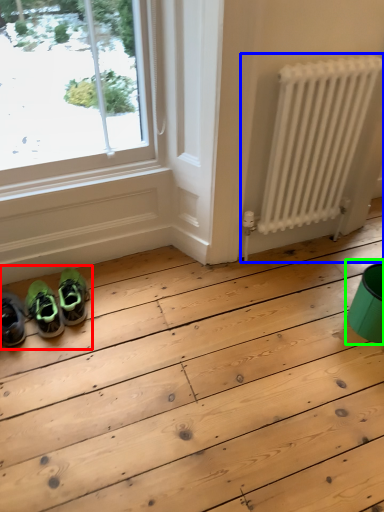
Question: Estimate the real-world distances between objects in this image. Which object is farther from couple (highlighted by a red box), radiator (highlighted by a blue box) or teal (highlighted by a green box)?

Choices:
 (A) radiator
 (B) teal

Answer: (B)